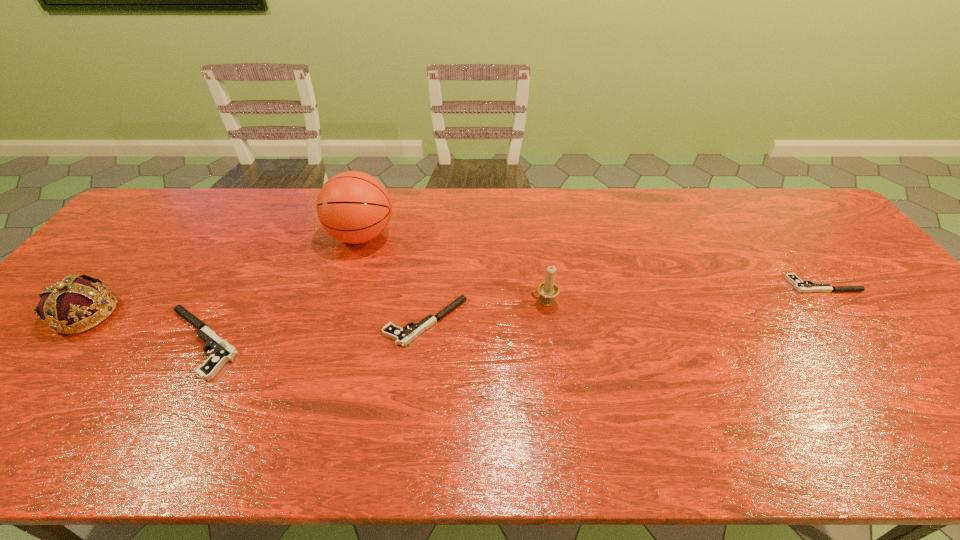
Locate an element on the screen. Image resolution: width=960 pixels, height=540 pixels. vacant point located on the handle side of the candle_holder is located at coordinates 492,303.

The height and width of the screenshot is (540, 960). I want to click on free location located on the handle side of the candle_holder, so click(387, 303).

Locate an element on the screen. free location located on the handle side of the candle_holder is located at coordinates (481, 303).

Find the location of `object that is at the far edge`. object that is at the far edge is located at coordinates (354, 207).

Locate an element on the screen. The width and height of the screenshot is (960, 540). object at the near edge is located at coordinates (223, 352).

This screenshot has width=960, height=540. Identify the location of object situated at the left edge. (72, 299).

The width and height of the screenshot is (960, 540). Find the location of `object that is at the right edge`. object that is at the right edge is located at coordinates (801, 286).

You are a GUI agent. You are given a task and a screenshot of the screen. Output one action in this format:
    pyautogui.click(x=<x>, y=<y>)
    Task: Click on the free region at the far edge of the desktop
    The height and width of the screenshot is (540, 960).
    Given the screenshot: What is the action you would take?
    pyautogui.click(x=224, y=212)

In the image, there is a desktop. Identify the location of vacant space at the near edge. (251, 380).

Where is `free space at the far left corner of the desktop`? Image resolution: width=960 pixels, height=540 pixels. free space at the far left corner of the desktop is located at coordinates [183, 202].